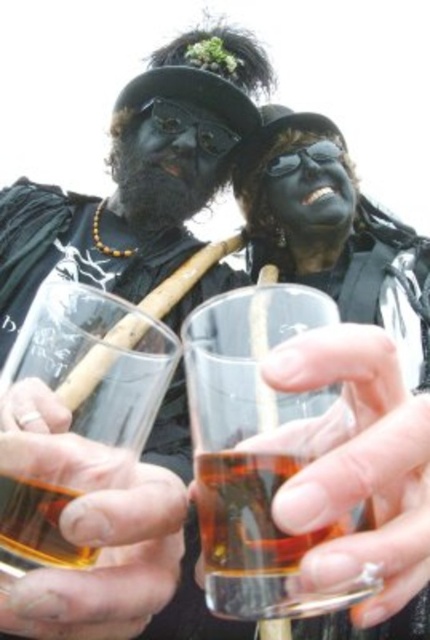
Question: In this image, where is translucent glass at center located relative to black matte face at center?

Choices:
 (A) left
 (B) right

Answer: (A)

Question: Does transparent glass at center appear on the left side of translucent plastic shot glass at center?

Choices:
 (A) no
 (B) yes

Answer: (B)

Question: From the image, what is the correct spatial relationship of transparent glass at center in relation to translucent plastic shot glass at center?

Choices:
 (A) above
 (B) below

Answer: (A)

Question: Which object is closer to the camera taking this photo?

Choices:
 (A) transparent glass at center
 (B) black matte face at center
 (C) black matte mask at center
 (D) translucent plastic shot glass at center

Answer: (D)

Question: Among these points, which one is farthest from the camera?

Choices:
 (A) (304, 572)
 (B) (168, 212)
 (C) (40, 573)
 (D) (40, 268)

Answer: (B)

Question: Which of the following is the farthest from the observer?

Choices:
 (A) black matte mask at center
 (B) transparent glass at center
 (C) black matte face at center

Answer: (A)